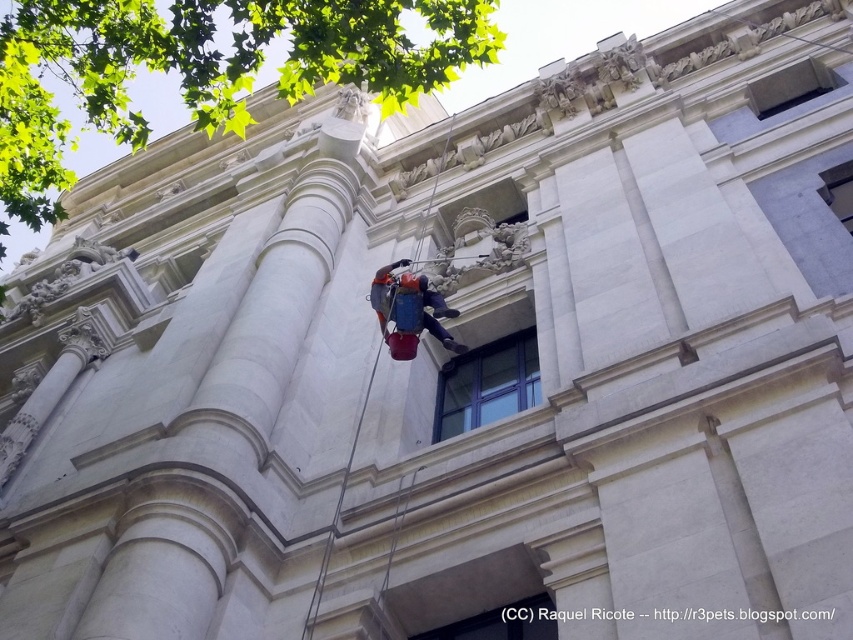
You are standing in front of the building and notice the blue glass window at center and the orange fabric harness at center. Which object is positioned to the right side from your perspective?

The blue glass window at center is to the right of the orange fabric harness at center, so the blue glass window at center is positioned to the right side.

You are a safety inspector assessing the setup of the window cleaning operation. The blue glass window at center and the orange fabric harness at center are both at the center of the image. According to safety regulations, the harness must be wider than the window to ensure stability. Does the current setup comply with safety standards?

The blue glass window at center is wider than the orange fabric harness at center, so the setup does not comply with safety standards because the harness is narrower than required.

You are standing in front of the building and see two points marked on the facade. Which point is closer to you, point (486, 369) or point (387, 316)?

Point (486, 369) is further to the viewer than point (387, 316), so point (387, 316) is closer to you.